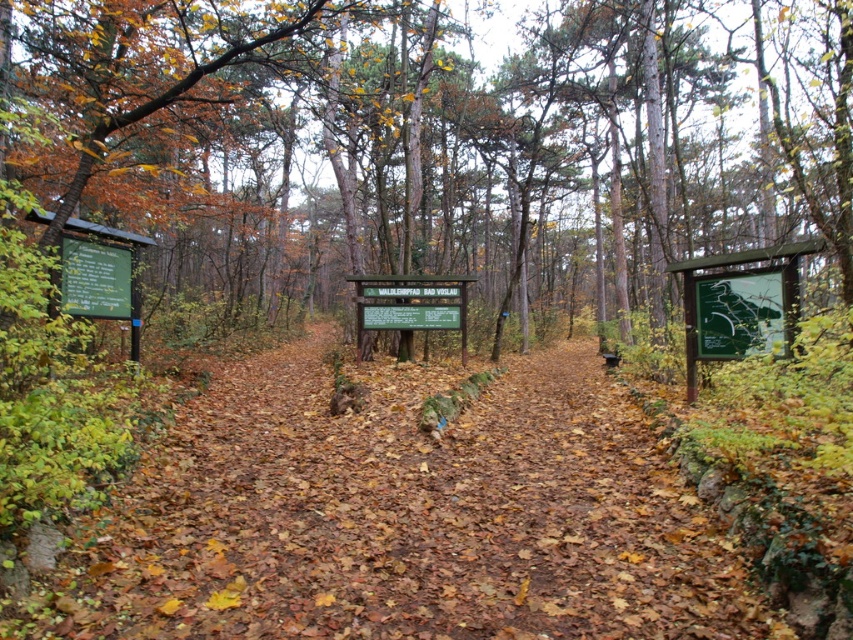
You are standing on the path in the forest scene and want to take a photo that includes both the point at coordinates (550,429) and the point at (80,273). Considering their positions, which point should you focus on first to ensure both are in clear view?

You should focus on point (80,273) first because it is closer to you than point (550,429), which is further away. This ensures both points remain in focus when taking the photo.

You are standing on the forest path and want to read both the brown wood sign at center and the green matte sign at left. Which sign should you approach first to read the one closer to you?

Result: The brown wood sign at center is closer to the viewer than the green matte sign at left, so you should approach the brown wood sign at center first to read the one closer to you.